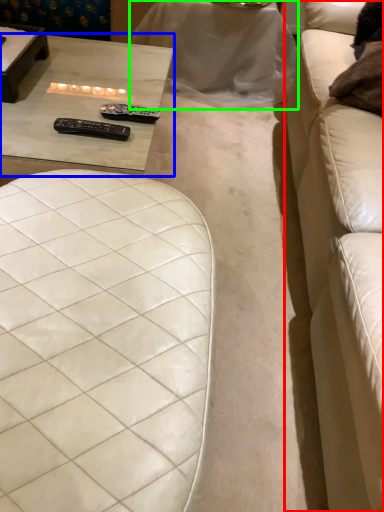
Question: Based on their relative distances, which object is farther from studio couch (highlighted by a red box)? Choose from table (highlighted by a blue box) and table (highlighted by a green box).

Choices:
 (A) table
 (B) table

Answer: (A)